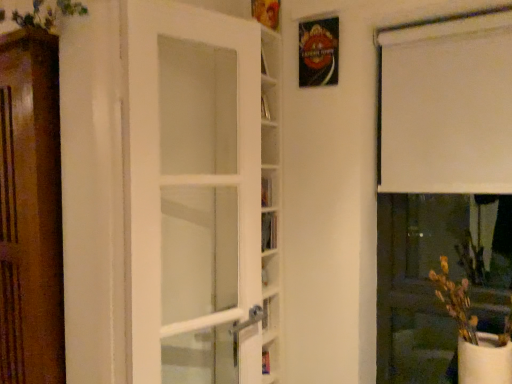
Question: Does green leafy plant at upper left turn towards white glass door at center?

Choices:
 (A) no
 (B) yes

Answer: (A)

Question: Is green leafy plant at upper left next to white glass door at center?

Choices:
 (A) no
 (B) yes

Answer: (A)

Question: Is white glass door at center at the back of green leafy plant at upper left?

Choices:
 (A) yes
 (B) no

Answer: (B)

Question: Is green leafy plant at upper left to the left of white glass door at center from the viewer's perspective?

Choices:
 (A) yes
 (B) no

Answer: (A)

Question: Can you confirm if green leafy plant at upper left is taller than white glass door at center?

Choices:
 (A) no
 (B) yes

Answer: (A)

Question: Considering the relative sizes of green leafy plant at upper left and white glass door at center in the image provided, is green leafy plant at upper left thinner than white glass door at center?

Choices:
 (A) yes
 (B) no

Answer: (A)

Question: Is the depth of hardcover book at center less than that of white matte vase at lower right?

Choices:
 (A) yes
 (B) no

Answer: (B)

Question: Is hardcover book at center far from white matte vase at lower right?

Choices:
 (A) yes
 (B) no

Answer: (A)

Question: Is hardcover book at center at the left side of white matte vase at lower right?

Choices:
 (A) yes
 (B) no

Answer: (A)

Question: Is hardcover book at center outside white matte vase at lower right?

Choices:
 (A) no
 (B) yes

Answer: (B)

Question: Is hardcover book at center looking in the opposite direction of white matte vase at lower right?

Choices:
 (A) yes
 (B) no

Answer: (B)

Question: Does hardcover book at center have a larger size compared to white matte vase at lower right?

Choices:
 (A) yes
 (B) no

Answer: (B)

Question: Does hardcover book at center have a greater width compared to white matte curtain at upper right?

Choices:
 (A) no
 (B) yes

Answer: (A)